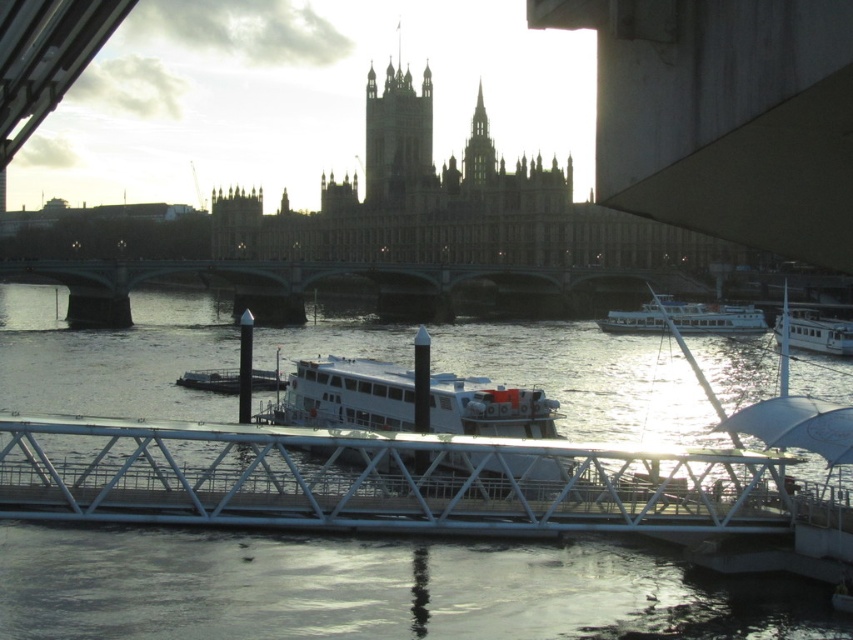
Question: Which of these objects is positioned closest to the white matte boat at center?

Choices:
 (A) smooth stone spire at upper center
 (B) white matte boat at right
 (C) golden stone tower at center
 (D) white glossy boat at right

Answer: (B)

Question: Is metallic gray bridge at center thinner than white matte boat at center?

Choices:
 (A) no
 (B) yes

Answer: (A)

Question: Which of the following is the closest to the observer?

Choices:
 (A) white glossy boat at right
 (B) golden stone tower at center
 (C) white matte boat at right

Answer: (C)

Question: Which object is positioned closest to the white matte boat at center?

Choices:
 (A) white matte boat at right
 (B) white metallic bridge at center
 (C) silvery metallic water at center

Answer: (B)

Question: Is metallic gray bridge at center to the left of smooth stone spire at upper center from the viewer's perspective?

Choices:
 (A) no
 (B) yes

Answer: (B)

Question: Does white metallic bridge at center appear on the right side of white matte boat at center?

Choices:
 (A) no
 (B) yes

Answer: (A)